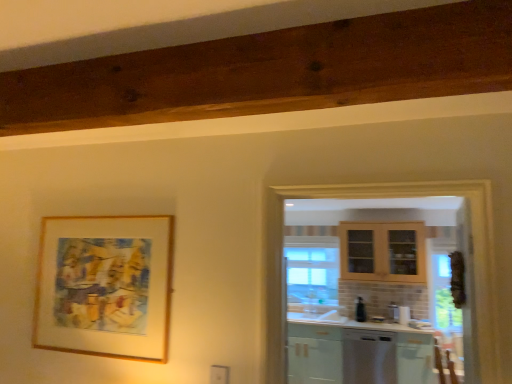
Find the location of `black glossy soap dispenser at center`. black glossy soap dispenser at center is located at coordinates (360, 310).

In order to face satin white dishwasher at lower right, should I rotate leftwards or rightwards?

To face it directly, rotate right by 14.883 degrees.

What do you see at coordinates (415, 358) in the screenshot? Image resolution: width=512 pixels, height=384 pixels. I see `matte white cabinet at lower right` at bounding box center [415, 358].

You are a GUI agent. You are given a task and a screenshot of the screen. Output one action in this format:
    pyautogui.click(x=<x>, y=<y>)
    Task: Click on the wooden frame at upper left
    The width and height of the screenshot is (512, 384).
    Given the screenshot: What is the action you would take?
    pyautogui.click(x=105, y=286)

From the image's perspective, which object appears higher, matte white cabinet at lower right or satin white dishwasher at lower right?

matte white cabinet at lower right, from the image's perspective.

Between matte white cabinet at lower right and satin white dishwasher at lower right, which one appears on the left side from the viewer's perspective?

satin white dishwasher at lower right.

Consider the image. Between matte white cabinet at lower right and satin white dishwasher at lower right, which one has more height?

Standing taller between the two is satin white dishwasher at lower right.

How distant is matte white cabinet at lower right from satin white dishwasher at lower right?

matte white cabinet at lower right is 31.95 centimeters away from satin white dishwasher at lower right.

Considering the relative sizes of black glossy soap dispenser at center and wooden frame at upper left in the image provided, is black glossy soap dispenser at center shorter than wooden frame at upper left?

Yes, black glossy soap dispenser at center is shorter than wooden frame at upper left.

Which object is positioned more to the left, black glossy soap dispenser at center or wooden frame at upper left?

From the viewer's perspective, wooden frame at upper left appears more on the left side.

Is black glossy soap dispenser at center inside the boundaries of wooden frame at upper left, or outside?

black glossy soap dispenser at center is outside wooden frame at upper left.

Where is `picture frame in front of the black glossy soap dispenser at center`? This screenshot has width=512, height=384. picture frame in front of the black glossy soap dispenser at center is located at coordinates (105, 286).

What are the coordinates of `dish washer below the wooden frame at upper left (from a real-world perspective)` in the screenshot? It's located at (368, 356).

Which point is more distant from viewer, (167, 247) or (359, 340)?

The point (359, 340) is more distant.

Is wooden frame at upper left to the left of satin white dishwasher at lower right from the viewer's perspective?

Yes, wooden frame at upper left is to the left of satin white dishwasher at lower right.

Considering the sizes of wooden frame at upper left and matte white cabinet at lower right in the image, is wooden frame at upper left wider or thinner than matte white cabinet at lower right?

Clearly, wooden frame at upper left has less width compared to matte white cabinet at lower right.

Is wooden frame at upper left turned away from matte white cabinet at lower right?

Yes, wooden frame at upper left is positioned with its back facing matte white cabinet at lower right.

Is wooden frame at upper left in front of or behind matte white cabinet at lower right in the image?

Clearly, wooden frame at upper left is in front of matte white cabinet at lower right.

Which is closer to the camera, (117,290) or (426,347)?

The point (117,290) is in front.

Does satin white dishwasher at lower right come in front of wooden frame at upper left?

No, it is behind wooden frame at upper left.

From a real-world perspective, which object stands above the other?

wooden frame at upper left, from a real-world perspective.

Considering the sizes of objects satin white dishwasher at lower right and wooden frame at upper left in the image provided, who is taller, satin white dishwasher at lower right or wooden frame at upper left?

Standing taller between the two is satin white dishwasher at lower right.

Between matte white cabinet at lower right and wooden frame at upper left, which one appears on the right side from the viewer's perspective?

matte white cabinet at lower right is more to the right.

Is wooden frame at upper left surrounded by matte white cabinet at lower right?

No, wooden frame at upper left is not inside matte white cabinet at lower right.

Which object is closer to the camera taking this photo, matte white cabinet at lower right or wooden frame at upper left?

wooden frame at upper left is more forward.

Is matte white cabinet at lower right looking in the opposite direction of wooden frame at upper left?

No, matte white cabinet at lower right is not facing the opposite direction of wooden frame at upper left.

Is black glossy soap dispenser at center to the left of matte white cabinet at lower right from the viewer's perspective?

Yes, black glossy soap dispenser at center is to the left of matte white cabinet at lower right.

Which object is wider, black glossy soap dispenser at center or matte white cabinet at lower right?

matte white cabinet at lower right is wider.

From a real-world perspective, who is located lower, black glossy soap dispenser at center or matte white cabinet at lower right?

In real-world perspective, matte white cabinet at lower right is lower.

Image resolution: width=512 pixels, height=384 pixels. In order to click on cabinetry that is on the right side of satin white dishwasher at lower right in this screenshot , I will do tap(415, 358).

Where is `picture frame on the left of black glossy soap dispenser at center`? picture frame on the left of black glossy soap dispenser at center is located at coordinates (105, 286).

From the image, which object appears to be nearer to satin white dishwasher at lower right, matte white cabinet at lower right or black glossy soap dispenser at center?

Among the two, matte white cabinet at lower right is located nearer to satin white dishwasher at lower right.

When comparing their distances from wooden frame at upper left, does matte white cabinet at lower right or satin white dishwasher at lower right seem closer?

matte white cabinet at lower right.

From the image, which object appears to be farther from matte white cabinet at lower right, black glossy soap dispenser at center or satin white dishwasher at lower right?

Among the two, black glossy soap dispenser at center is located further to matte white cabinet at lower right.

When comparing their distances from wooden frame at upper left, does black glossy soap dispenser at center or matte white cabinet at lower right seem closer?

matte white cabinet at lower right is closer to wooden frame at upper left.

Based on their spatial positions, is satin white dishwasher at lower right or matte white cabinet at lower right further from wooden frame at upper left?

Among the two, satin white dishwasher at lower right is located further to wooden frame at upper left.

Based on their spatial positions, is black glossy soap dispenser at center or matte white cabinet at lower right closer to satin white dishwasher at lower right?

Based on the image, matte white cabinet at lower right appears to be nearer to satin white dishwasher at lower right.

Estimate the real-world distances between objects in this image. Which object is further from wooden frame at upper left, satin white dishwasher at lower right or black glossy soap dispenser at center?

black glossy soap dispenser at center lies further to wooden frame at upper left than the other object.

Which object lies nearer to the anchor point black glossy soap dispenser at center, matte white cabinet at lower right or wooden frame at upper left?

matte white cabinet at lower right is closer to black glossy soap dispenser at center.

You are a GUI agent. You are given a task and a screenshot of the screen. Output one action in this format:
    pyautogui.click(x=<x>, y=<y>)
    Task: Click on the cabinetry between wooden frame at upper left and satin white dishwasher at lower right along the z-axis
    This screenshot has height=384, width=512.
    Given the screenshot: What is the action you would take?
    pyautogui.click(x=415, y=358)

Locate an element on the screen. The width and height of the screenshot is (512, 384). cabinetry between wooden frame at upper left and black glossy soap dispenser at center along the z-axis is located at coordinates (415, 358).

The height and width of the screenshot is (384, 512). Find the location of `dish washer positioned between wooden frame at upper left and black glossy soap dispenser at center from near to far`. dish washer positioned between wooden frame at upper left and black glossy soap dispenser at center from near to far is located at coordinates (368, 356).

Locate an element on the screen. dish washer located between matte white cabinet at lower right and black glossy soap dispenser at center in the depth direction is located at coordinates (368, 356).